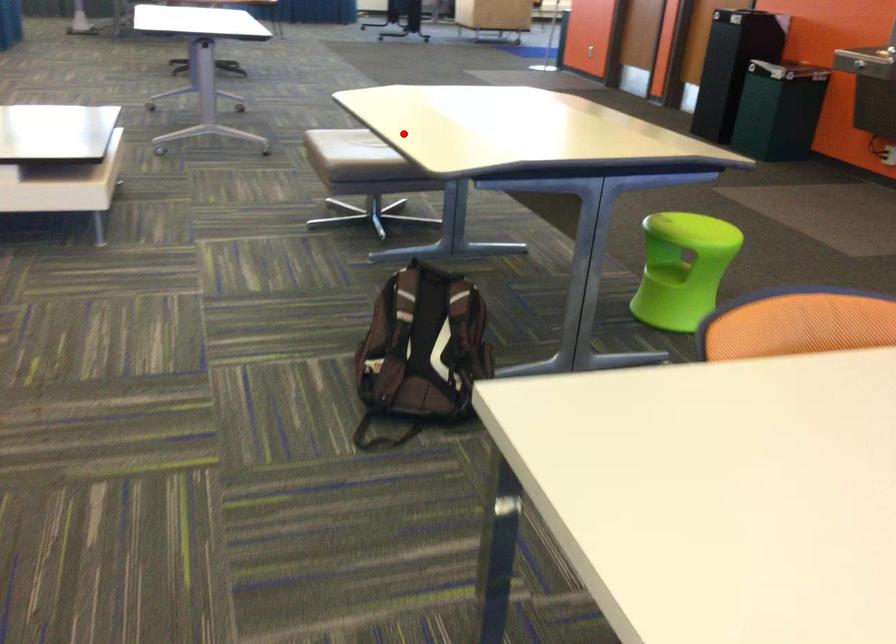
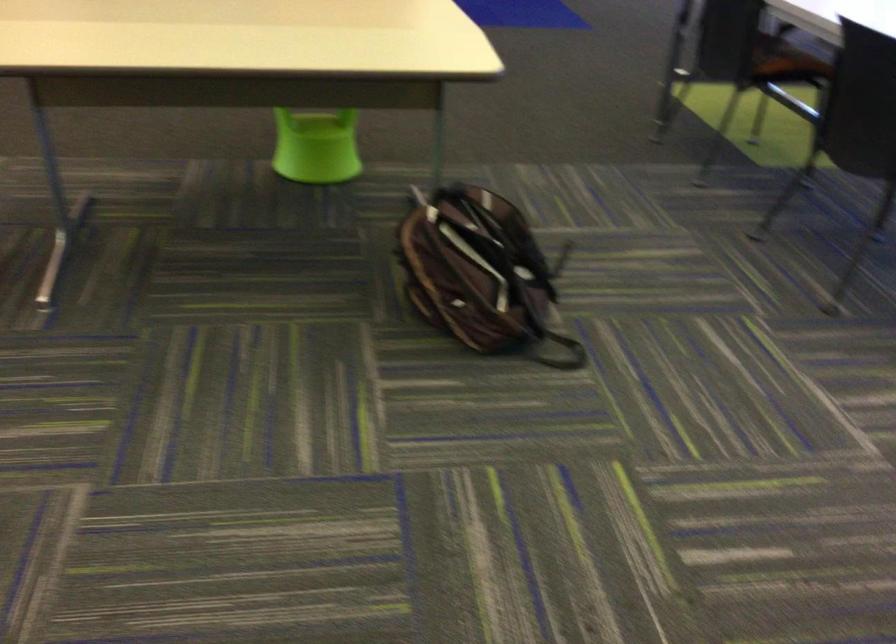
Question: I am providing you with two images of the same scene from different viewpoints. Image1 has a red point marked. In image2, the corresponding 3D location appears at what relative position? Reply with the corresponding letter.

Choices:
 (A) Closer
 (B) Farther

Answer: (A)